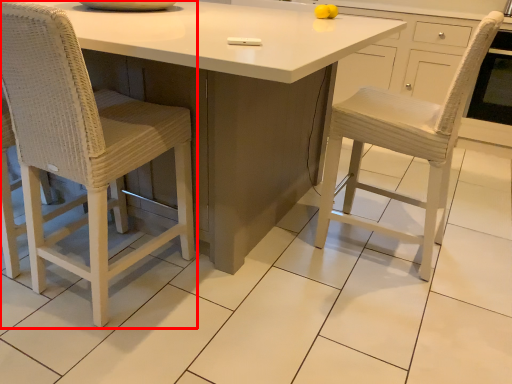
Question: From the image's perspective, where is chair (annotated by the red box) located in relation to table in the image?

Choices:
 (A) below
 (B) above

Answer: (A)